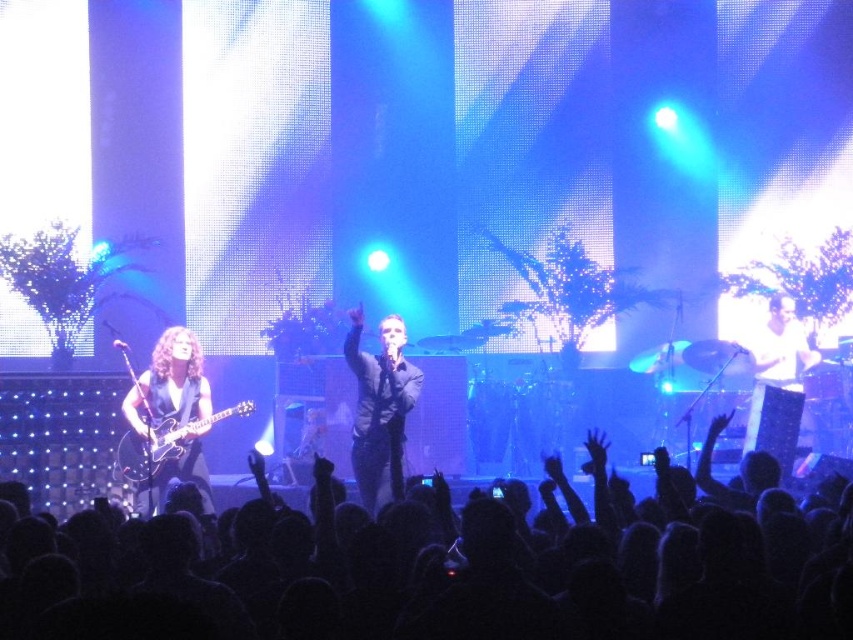
You are a photographer at the concert. You want to capture a photo that includes both the black fabric crowd at center and the black matte suit at center. Which one should you focus on first to ensure both are in the frame?

The black fabric crowd at center is located below the black matte suit at center, so you should focus on the black matte suit at center first to ensure both are in the frame.

You are a photographer at the concert and want to capture the entire black fabric crowd at center and black matte suit at center in a single frame. Which object should you focus on to ensure both are in the shot?

Since the black fabric crowd at center is wider than the black matte suit at center, you should focus on the black fabric crowd at center to ensure both objects are included in the frame.